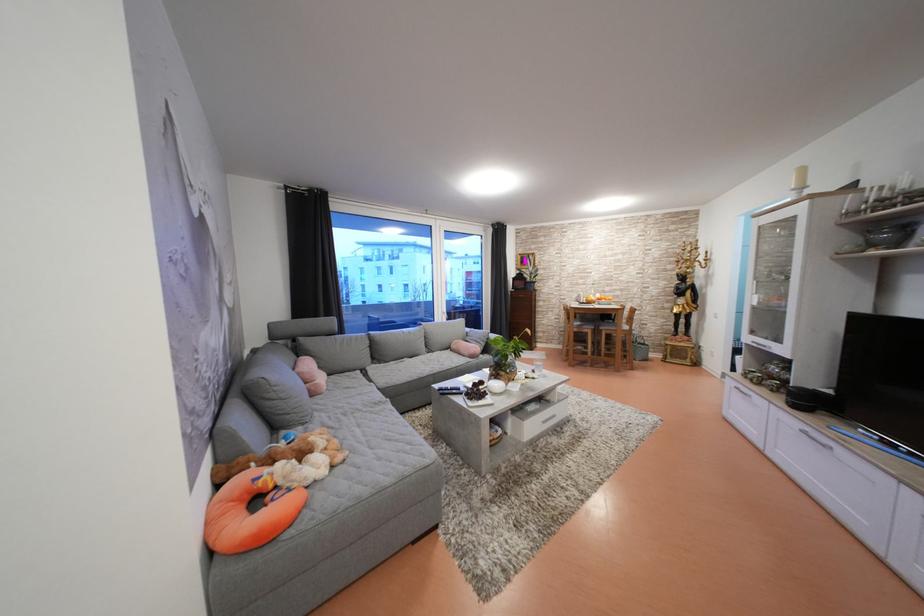
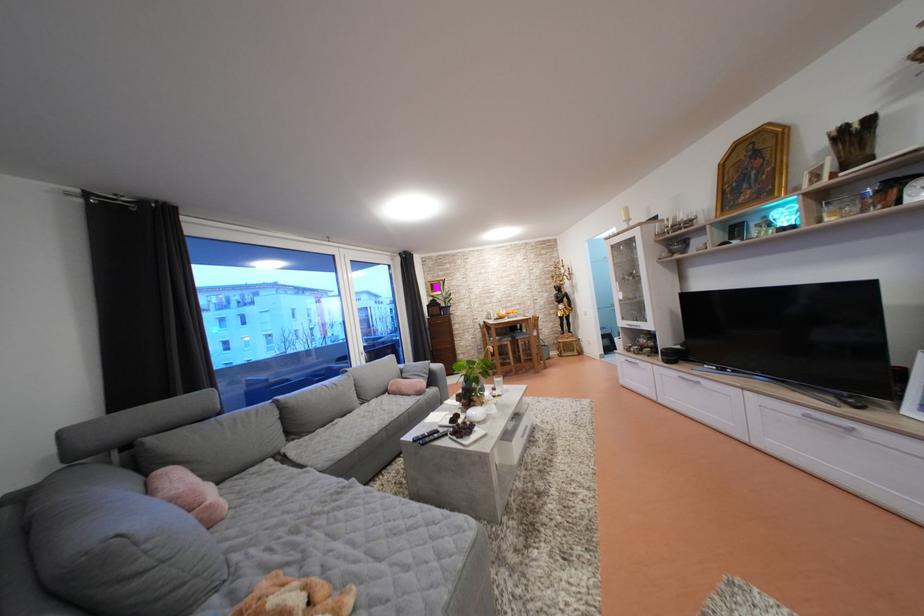
Which direction would the cameraman need to move to produce the second image?

The movement direction of the cameraman is left, forward.